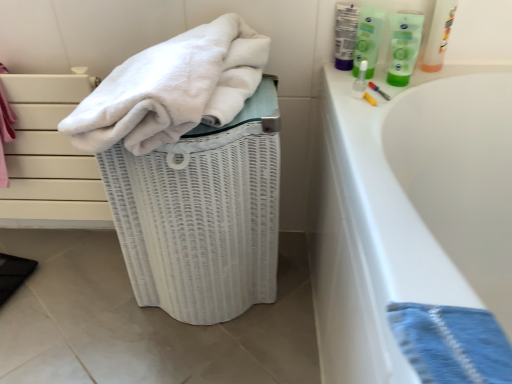
The width and height of the screenshot is (512, 384). Identify the location of white wicker laundry basket at left. (202, 214).

Locate an element on the screen. Image resolution: width=512 pixels, height=384 pixels. blue woven towel at lower right is located at coordinates (451, 343).

The height and width of the screenshot is (384, 512). In order to click on green plastic tube at upper right in this screenshot , I will do `click(404, 45)`.

From the image's perspective, is white matte drawer at left below green plastic bottle at upper right?

Indeed, from the image's perspective, white matte drawer at left is shown beneath green plastic bottle at upper right.

Is white matte drawer at left far from green plastic bottle at upper right?

No, white matte drawer at left is not far from green plastic bottle at upper right.

From a real-world perspective, who is located higher, white matte drawer at left or green plastic bottle at upper right?

green plastic bottle at upper right.

From the picture: How many degrees apart are the facing directions of white matte drawer at left and green plastic bottle at upper right?

They differ by 34.4 degrees in their facing directions.

From the image's perspective, who appears lower, blue woven towel at lower right or green plastic tube at upper right?

blue woven towel at lower right, from the image's perspective.

Is blue woven towel at lower right shorter than green plastic tube at upper right?

Correct, blue woven towel at lower right is not as tall as green plastic tube at upper right.

Which is further, (498, 357) or (406, 73)?

A: The point (406, 73) is farther from the camera.

Does blue woven towel at lower right have a greater width compared to green plastic tube at upper right?

Yes.

Identify the location of toiletry on the right of white matte drawer at left. (404, 45).

Relative to green plastic tube at upper right, is white matte drawer at left in front or behind?

white matte drawer at left is positioned farther from the viewer than green plastic tube at upper right.

Is there a large distance between white matte drawer at left and green plastic tube at upper right?

That's not correct — white matte drawer at left is a little close to green plastic tube at upper right.

Is white matte drawer at left turned away from green plastic tube at upper right?

white matte drawer at left is not turned away from green plastic tube at upper right.

Where is `drawer below the green plastic tube at upper right (from the image's perspective)`? This screenshot has height=384, width=512. drawer below the green plastic tube at upper right (from the image's perspective) is located at coordinates click(x=49, y=158).

Is white matte drawer at left surrounded by green plastic tube at upper right?

That's incorrect, white matte drawer at left is not inside green plastic tube at upper right.

What's the angular difference between green plastic tube at upper right and white matte drawer at left's facing directions?

The angle between the facing direction of green plastic tube at upper right and the facing direction of white matte drawer at left is 26.3 degrees.

Choose the correct answer: Is white wicker laundry basket at left inside blue woven towel at lower right or outside it?

white wicker laundry basket at left is located beyond the bounds of blue woven towel at lower right.

Is white wicker laundry basket at left far from blue woven towel at lower right?

white wicker laundry basket at left is actually quite close to blue woven towel at lower right.

Considering their positions, is white wicker laundry basket at left located in front of or behind blue woven towel at lower right?

In the image, white wicker laundry basket at left appears behind blue woven towel at lower right.

Is white wicker laundry basket at left taller or shorter than blue woven towel at lower right?

white wicker laundry basket at left is taller than blue woven towel at lower right.

Considering the relative positions of white matte drawer at left and white soft towel at upper left in the image provided, is white matte drawer at left to the right of white soft towel at upper left from the viewer's perspective?

A: In fact, white matte drawer at left is to the left of white soft towel at upper left.

Does white matte drawer at left contain white soft towel at upper left?

Definitely not — white soft towel at upper left is not inside white matte drawer at left.

In the scene shown: Can you confirm if white matte drawer at left is shorter than white soft towel at upper left?

In fact, white matte drawer at left may be taller than white soft towel at upper left.

Considering the sizes of objects white matte drawer at left and white soft towel at upper left in the image provided, who is wider, white matte drawer at left or white soft towel at upper left?

Wider between the two is white soft towel at upper left.

I want to click on towel above the white wicker laundry basket at left (from the image's perspective), so click(172, 89).

How different are the orientations of white wicker laundry basket at left and white soft towel at upper left in degrees?

The angle between the facing direction of white wicker laundry basket at left and the facing direction of white soft towel at upper left is 6.73 degrees.

In terms of height, does white wicker laundry basket at left look taller or shorter compared to white soft towel at upper left?

Considering their sizes, white wicker laundry basket at left has more height than white soft towel at upper left.

In the image, is white wicker laundry basket at left on the left side or the right side of white soft towel at upper left?

From the image, it's evident that white wicker laundry basket at left is to the right of white soft towel at upper left.

This screenshot has height=384, width=512. I want to click on cleaning product above the white matte drawer at left (from a real-world perspective), so click(368, 39).

Find the location of `toiletry above the blue woven towel at lower right (from the image's perspective)`. toiletry above the blue woven towel at lower right (from the image's perspective) is located at coordinates (404, 45).

Based on their spatial positions, is white wicker laundry basket at left or green plastic tube at upper right closer to white soft towel at upper left?

white wicker laundry basket at left lies closer to white soft towel at upper left than the other object.

Consider the image. From the image, which object appears to be farther from white wicker laundry basket at left, white matte drawer at left or green plastic bottle at upper right?

The object further to white wicker laundry basket at left is green plastic bottle at upper right.

From the image, which object appears to be farther from green plastic tube at upper right, blue woven towel at lower right or white soft towel at upper left?

The object further to green plastic tube at upper right is blue woven towel at lower right.

When comparing their distances from green plastic tube at upper right, does white wicker laundry basket at left or green plastic bottle at upper right seem further?

white wicker laundry basket at left lies further to green plastic tube at upper right than the other object.

Which object lies further to the anchor point blue woven towel at lower right, green plastic bottle at upper right or white matte drawer at left?

white matte drawer at left lies further to blue woven towel at lower right than the other object.

Considering their positions, is green plastic bottle at upper right positioned further to white soft towel at upper left than white wicker laundry basket at left?

green plastic bottle at upper right is further to white soft towel at upper left.

Which object lies further to the anchor point white matte drawer at left, blue woven towel at lower right or white wicker laundry basket at left?

Based on the image, blue woven towel at lower right appears to be further to white matte drawer at left.

Which object lies nearer to the anchor point green plastic tube at upper right, white matte drawer at left or white soft towel at upper left?

white soft towel at upper left is closer to green plastic tube at upper right.

At what (x,y) coordinates should I click in order to perform the action: click on cleaning product located between white matte drawer at left and green plastic tube at upper right in the left-right direction. Please return your answer as a coordinate pair (x, y). The width and height of the screenshot is (512, 384). Looking at the image, I should click on (368, 39).

Locate an element on the screen. laundry basket situated between white matte drawer at left and green plastic bottle at upper right from left to right is located at coordinates (202, 214).

Where is `towel between blue woven towel at lower right and green plastic tube at upper right from front to back`? towel between blue woven towel at lower right and green plastic tube at upper right from front to back is located at coordinates (172, 89).

Identify the location of towel between white matte drawer at left and green plastic bottle at upper right. (172, 89).